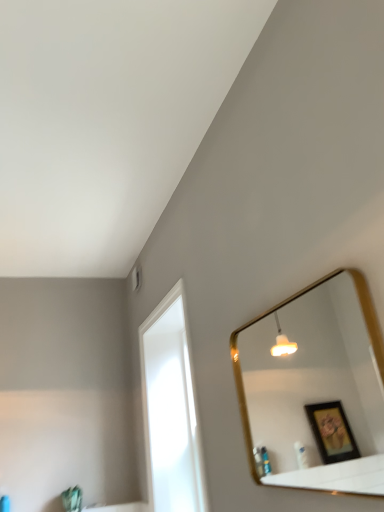
Question: Looking at the image, does gold metallic mirror at upper right seem bigger or smaller compared to transparent glass window at upper left?

Choices:
 (A) small
 (B) big

Answer: (A)

Question: Is gold metallic mirror at upper right inside the boundaries of transparent glass window at upper left, or outside?

Choices:
 (A) inside
 (B) outside

Answer: (B)

Question: Is gold metallic mirror at upper right to the left or to the right of transparent glass window at upper left in the image?

Choices:
 (A) right
 (B) left

Answer: (A)

Question: In the image, is transparent glass window at upper left on the left side or the right side of gold metallic mirror at upper right?

Choices:
 (A) left
 (B) right

Answer: (A)

Question: Is transparent glass window at upper left taller or shorter than gold metallic mirror at upper right?

Choices:
 (A) tall
 (B) short

Answer: (A)

Question: Looking at their shapes, would you say transparent glass window at upper left is wider or thinner than gold metallic mirror at upper right?

Choices:
 (A) wide
 (B) thin

Answer: (A)

Question: From the image's perspective, is transparent glass window at upper left positioned above or below gold metallic mirror at upper right?

Choices:
 (A) below
 (B) above

Answer: (A)